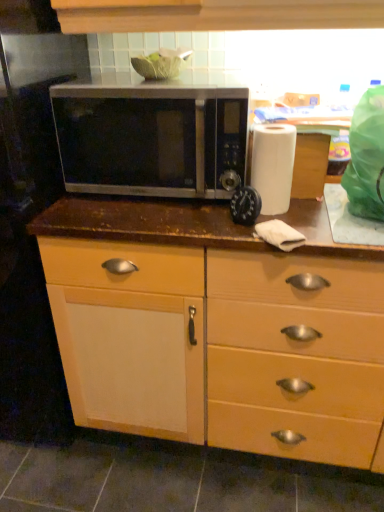
Question: From the image's perspective, is black plastic timer at center positioned above or below satin silver microwave at center?

Choices:
 (A) above
 (B) below

Answer: (B)

Question: Is point (x=253, y=223) closer or farther from the camera than point (x=102, y=111)?

Choices:
 (A) farther
 (B) closer

Answer: (B)

Question: Based on their relative distances, which object is farther from the white matte paper towel at right?

Choices:
 (A) satin silver microwave at center
 (B) black plastic timer at center
 (C) matte wood cabinet at center

Answer: (C)

Question: Based on their relative distances, which object is farther from the white matte paper towel at right?

Choices:
 (A) black plastic timer at center
 (B) matte wood cabinet at center
 (C) satin silver microwave at center

Answer: (B)